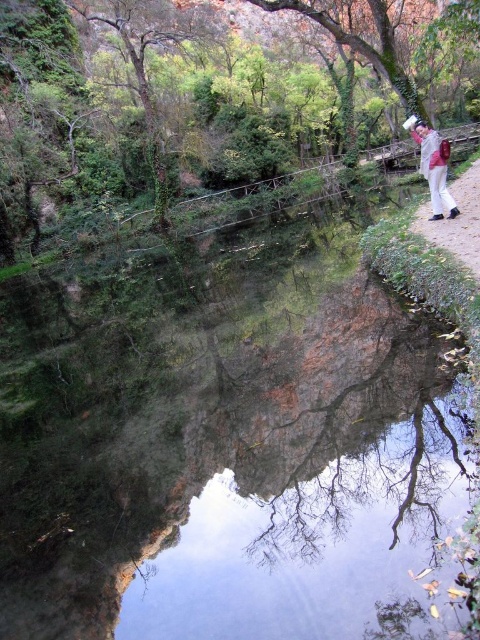
Is brown dirt path at right bigger than white cotton pants at center?

Actually, brown dirt path at right might be smaller than white cotton pants at center.

Is point (467, 177) positioned after point (443, 141)?

Yes, point (467, 177) is behind point (443, 141).

Does point (457, 232) come farther from viewer compared to point (436, 148)?

That is False.

Identify the location of brown dirt path at right. This screenshot has width=480, height=640. (456, 220).

Between green leafy tree at upper center and brown dirt path at right, which one is positioned higher?

Positioned higher is green leafy tree at upper center.

Can you confirm if green leafy tree at upper center is positioned to the left of brown dirt path at right?

Yes, green leafy tree at upper center is to the left of brown dirt path at right.

Which is behind, point (80, 13) or point (475, 172)?

The point (80, 13) is more distant.

At what (x,y) coordinates should I click in order to perform the action: click on green leafy tree at upper center. Please return your answer as a coordinate pair (x, y). The image size is (480, 640). Looking at the image, I should click on (205, 100).

Who is more forward, (x=218, y=33) or (x=445, y=193)?

Point (x=445, y=193) is more forward.

Describe the element at coordinates (205, 100) in the screenshot. I see `green leafy tree at upper center` at that location.

Who is more forward, (215, 90) or (432, 196)?

Positioned in front is point (432, 196).

This screenshot has height=640, width=480. I want to click on green leafy tree at upper center, so click(205, 100).